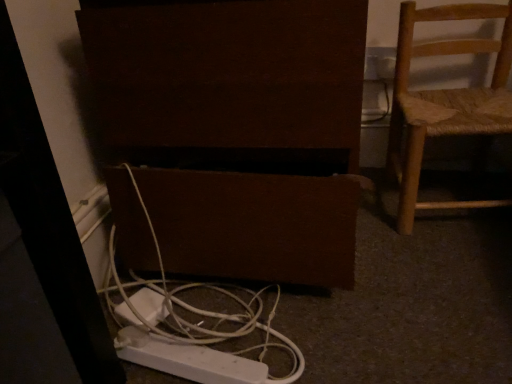
Measure the distance between woven wood chair at right and camera.

woven wood chair at right is 32.45 inches from camera.

Consider the image. Measure the distance between white plastic cable at lower center and camera.

white plastic cable at lower center is 59.80 centimeters away from camera.

I want to click on white plastic cable at lower center, so 191,330.

Locate an element on the screen. The width and height of the screenshot is (512, 384). brown matte speaker at lower center is located at coordinates (238, 130).

The width and height of the screenshot is (512, 384). Find the location of `woven wood chair at right`. woven wood chair at right is located at coordinates (445, 101).

From a real-world perspective, which is physically below, brown matte speaker at lower center or white plastic outlet at upper right?

brown matte speaker at lower center.

Considering the relative sizes of brown matte speaker at lower center and white plastic outlet at upper right in the image provided, is brown matte speaker at lower center smaller than white plastic outlet at upper right?

No.

In the image, is brown matte speaker at lower center positioned in front of or behind white plastic outlet at upper right?

brown matte speaker at lower center is in front of white plastic outlet at upper right.

Which is closer to the camera, (503, 15) or (276, 79)?

The point (276, 79) is in front.

From the picture: Is woven wood chair at right in contact with brown matte speaker at lower center?

No, woven wood chair at right is not in contact with brown matte speaker at lower center.

Does woven wood chair at right have a greater height compared to brown matte speaker at lower center?

In fact, woven wood chair at right may be shorter than brown matte speaker at lower center.

Measure the distance from brown matte speaker at lower center to white plastic cable at lower center.

brown matte speaker at lower center and white plastic cable at lower center are 5.94 inches apart.

Could you tell me if brown matte speaker at lower center is facing white plastic cable at lower center?

Yes, brown matte speaker at lower center is aimed at white plastic cable at lower center.

From the image's perspective, is brown matte speaker at lower center located above white plastic cable at lower center?

Yes.

Is there a large distance between white plastic cable at lower center and white plastic outlet at upper right?

They are positioned close to each other.

How distant is white plastic cable at lower center from white plastic outlet at upper right?

white plastic cable at lower center and white plastic outlet at upper right are 30.11 inches apart from each other.

From the picture: Is white plastic cable at lower center positioned behind white plastic outlet at upper right?

No, the depth of white plastic cable at lower center is less than that of white plastic outlet at upper right.

Considering the points (274, 309) and (388, 48), which point is in front, point (274, 309) or point (388, 48)?

Positioned in front is point (274, 309).

Which object is further away from the camera taking this photo, white plastic outlet at upper right or brown matte speaker at lower center?

Positioned behind is white plastic outlet at upper right.

This screenshot has height=384, width=512. I want to click on electric outlet behind the brown matte speaker at lower center, so click(379, 63).

From the image's perspective, does white plastic outlet at upper right appear lower than brown matte speaker at lower center?

No, from the image's perspective, white plastic outlet at upper right is not below brown matte speaker at lower center.

Is white plastic outlet at upper right aimed at brown matte speaker at lower center?

No, white plastic outlet at upper right is not turned towards brown matte speaker at lower center.

What's the angular difference between brown matte speaker at lower center and woven wood chair at right's facing directions?

They differ by 5.37 degrees in their facing directions.

Does brown matte speaker at lower center contain woven wood chair at right?

No.

Is brown matte speaker at lower center positioned with its back to woven wood chair at right?

No.

From the image's perspective, does brown matte speaker at lower center appear higher than woven wood chair at right?

No, from the image's perspective, brown matte speaker at lower center is not over woven wood chair at right.

In terms of height, does white plastic cable at lower center look taller or shorter compared to brown matte speaker at lower center?

In the image, white plastic cable at lower center appears to be shorter than brown matte speaker at lower center.

Could you tell me if white plastic cable at lower center is turned towards brown matte speaker at lower center?

No, white plastic cable at lower center is not turned towards brown matte speaker at lower center.

From the image's perspective, between white plastic cable at lower center and brown matte speaker at lower center, who is located below?

white plastic cable at lower center, from the image's perspective.

Locate an element on the screen. Image resolution: width=512 pixels, height=384 pixels. furniture lying on the left of white plastic outlet at upper right is located at coordinates (238, 130).

At what (x,y) coordinates should I click in order to perform the action: click on furniture that is below the woven wood chair at right (from the image's perspective). Please return your answer as a coordinate pair (x, y). This screenshot has height=384, width=512. Looking at the image, I should click on (238, 130).

Consider the image. Looking at the image, which one is located closer to brown matte speaker at lower center, white plastic cable at lower center or white plastic outlet at upper right?

Based on the image, white plastic cable at lower center appears to be nearer to brown matte speaker at lower center.

Looking at the image, which one is located closer to white plastic outlet at upper right, brown matte speaker at lower center or woven wood chair at right?

Among the two, woven wood chair at right is located nearer to white plastic outlet at upper right.

When comparing their distances from white plastic outlet at upper right, does woven wood chair at right or white plastic cable at lower center seem closer?

woven wood chair at right is positioned closer to the anchor white plastic outlet at upper right.

Looking at this image, when comparing their distances from white plastic cable at lower center, does brown matte speaker at lower center or woven wood chair at right seem closer?

Among the two, brown matte speaker at lower center is located nearer to white plastic cable at lower center.

Considering their positions, is white plastic outlet at upper right positioned closer to white plastic cable at lower center than brown matte speaker at lower center?

Among the two, brown matte speaker at lower center is located nearer to white plastic cable at lower center.

Based on the photo, from the image, which object appears to be nearer to woven wood chair at right, white plastic outlet at upper right or white plastic cable at lower center?

Based on the image, white plastic outlet at upper right appears to be nearer to woven wood chair at right.

Considering their positions, is white plastic cable at lower center positioned closer to woven wood chair at right than white plastic outlet at upper right?

white plastic outlet at upper right lies closer to woven wood chair at right than the other object.

Estimate the real-world distances between objects in this image. Which object is further from woven wood chair at right, brown matte speaker at lower center or white plastic outlet at upper right?

brown matte speaker at lower center is positioned further to the anchor woven wood chair at right.

Locate an element on the screen. chair between brown matte speaker at lower center and white plastic outlet at upper right along the z-axis is located at coordinates (445, 101).

Locate an element on the screen. cable between brown matte speaker at lower center and white plastic outlet at upper right from front to back is located at coordinates (191, 330).

Image resolution: width=512 pixels, height=384 pixels. Identify the location of furniture between white plastic cable at lower center and woven wood chair at right. (238, 130).

Find the location of `chair that lies between white plastic outlet at upper right and white plastic cable at lower center from top to bottom`. chair that lies between white plastic outlet at upper right and white plastic cable at lower center from top to bottom is located at coordinates (445, 101).